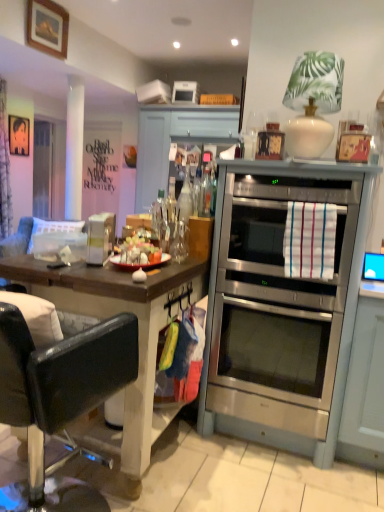
Question: Based on their positions, is metallic silver picture frame at upper left, which is counted as the 2th picture frame, starting from the right, located to the left or right of white plastic toaster at upper center?

Choices:
 (A) right
 (B) left

Answer: (B)

Question: Is metallic silver picture frame at upper left, which is counted as the 2th picture frame, starting from the right, bigger or smaller than white plastic toaster at upper center?

Choices:
 (A) small
 (B) big

Answer: (A)

Question: Which object is positioned farthest from the metallic silver picture frame at upper left, which is counted as the 2th picture frame, starting from the right?

Choices:
 (A) wooden framed picture at upper left, positioned as the 2th picture frame in back-to-front order
 (B) black leather chair at left
 (C) blue glossy monitor at right
 (D) transparent glass door at left
 (E) stainless steel oven at center

Answer: (C)

Question: Which object is the farthest from the stainless steel oven at center?

Choices:
 (A) metallic silver picture frame at upper left, the 1th picture frame viewed from the back
 (B) black leather chair at left
 (C) transparent glass door at left
 (D) wooden framed picture at upper left, which ranks as the first picture frame in front-to-back order
 (E) white plastic toaster at upper center

Answer: (C)